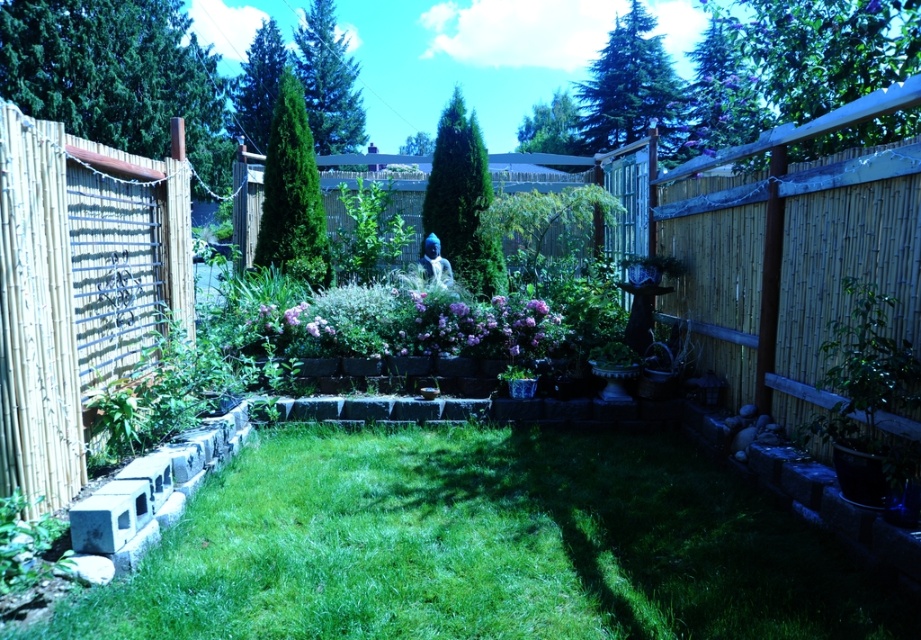
Question: Is green grass at center thinner than green leafy plant at lower left?

Choices:
 (A) yes
 (B) no

Answer: (B)

Question: Can you confirm if green grass at center is thinner than green leafy plant at lower left?

Choices:
 (A) no
 (B) yes

Answer: (A)

Question: Which point appears closest to the camera in this image?

Choices:
 (A) (825, 556)
 (B) (31, 522)

Answer: (B)

Question: Which point is closer to the camera?

Choices:
 (A) (7, 564)
 (B) (476, 586)

Answer: (A)

Question: Is green grass at center behind green leafy plant at lower left?

Choices:
 (A) no
 (B) yes

Answer: (A)